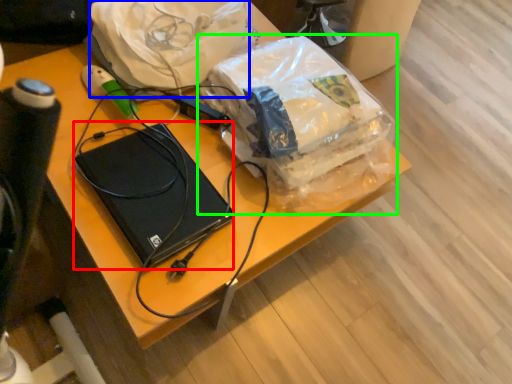
Question: Based on their relative distances, which object is farther from computer (highlighted by a red box)? Choose from material (highlighted by a blue box) and plastic bag (highlighted by a green box).

Choices:
 (A) material
 (B) plastic bag

Answer: (A)